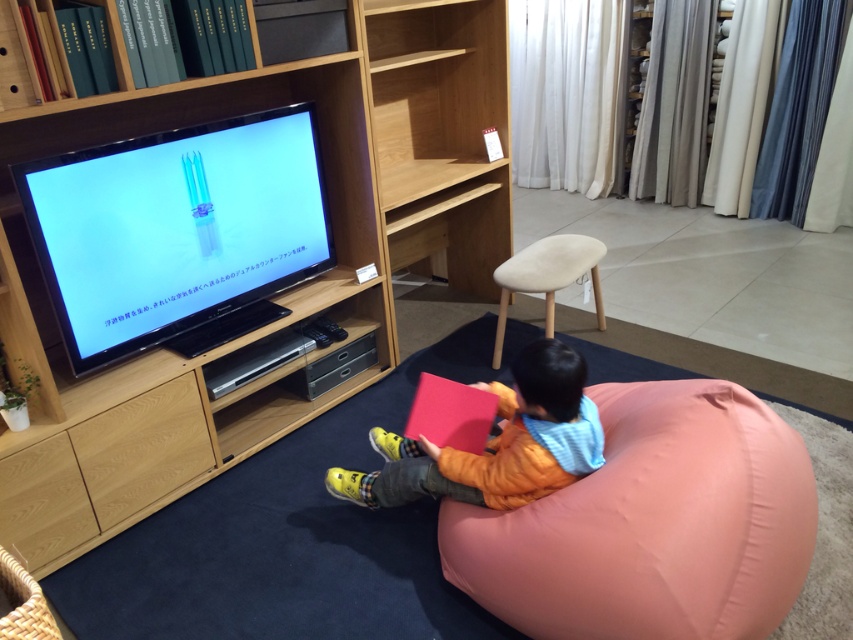
You are trying to decide where to place a new rectangular coffee table that is 1.2 meters wide. The room has limited space. Based on the scene, which object between the wooden entertainment center at left and the orange fabric bean bag at lower center would you consider moving to accommodate the table, and why?

The wooden entertainment center at left might be wider than orange fabric bean bag at lower center. Since the coffee table is 1.2 meters wide, moving the narrower object, the orange fabric bean bag at lower center, would require less space and be easier to relocate to make room for the table.

You are a delivery person who needs to place a new TV stand that is the same size as the wooden entertainment center at left. The orange fabric bean bag at lower center is currently occupying the space where the new stand should go. Can the new TV stand be placed there without moving the bean bag?

The wooden entertainment center at left is larger in size than the orange fabric bean bag at lower center. Since the new TV stand is the same size as the wooden entertainment center at left, it cannot be placed in the space occupied by the orange fabric bean bag at lower center because the bean bag is smaller and may not provide enough space.